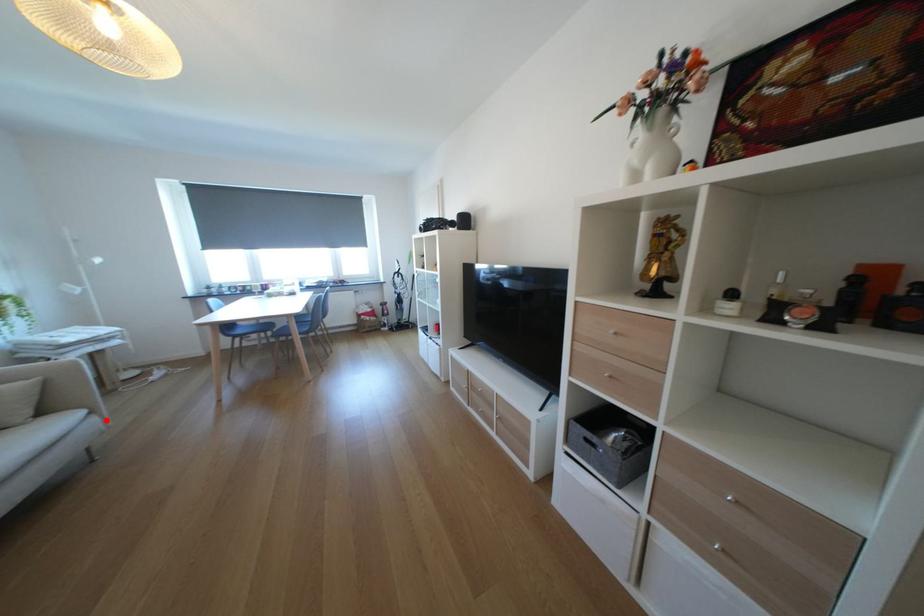
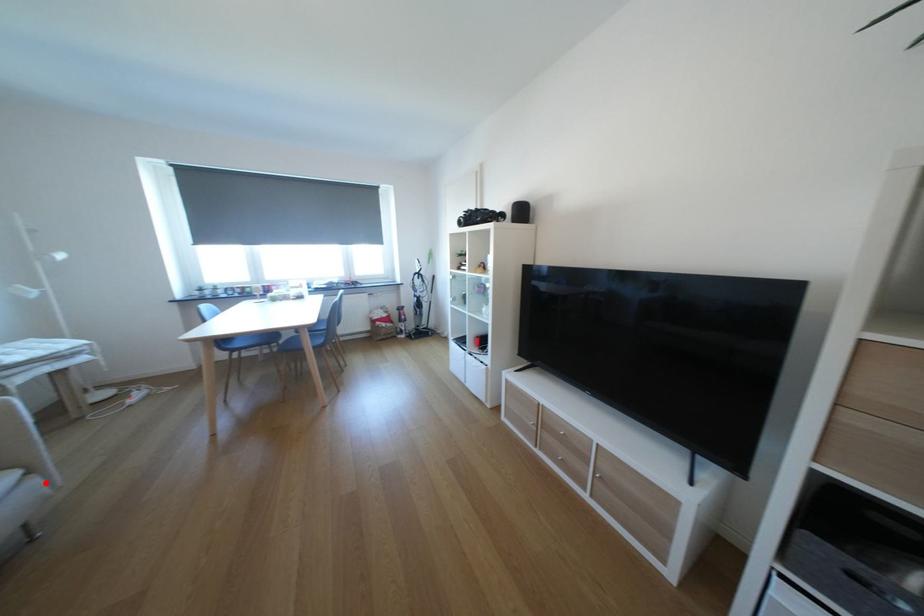
I am providing you with two images of the same scene from different viewpoints. A red point is marked on the first image and another point is marked on the second image. Does the point marked in image1 correspond to the same location as the one in image2?

Yes